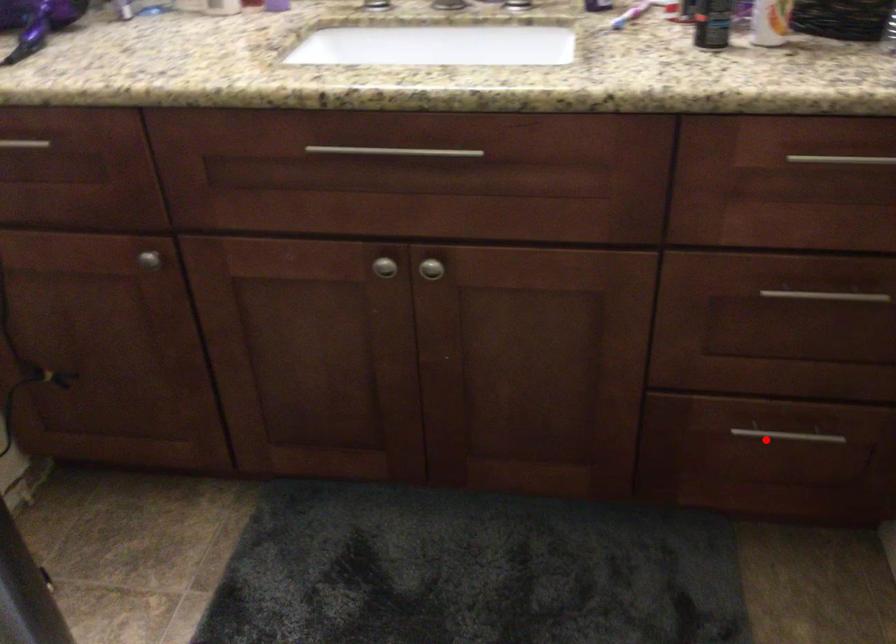
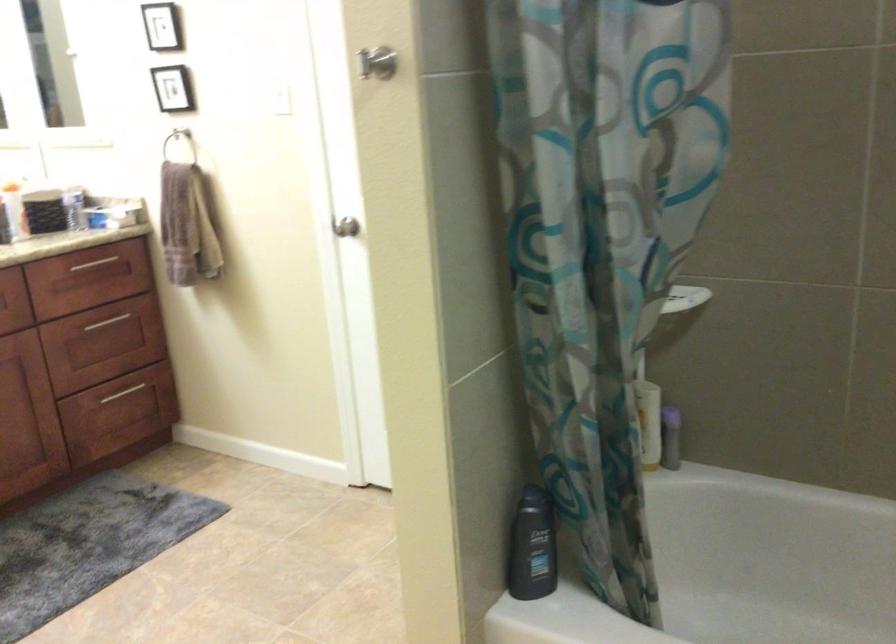
Question: I am providing you with two images of the same scene from different viewpoints. A red point is marked on the first image. Can you still see the location of the red point in image 2?

Choices:
 (A) Yes
 (B) No

Answer: (A)